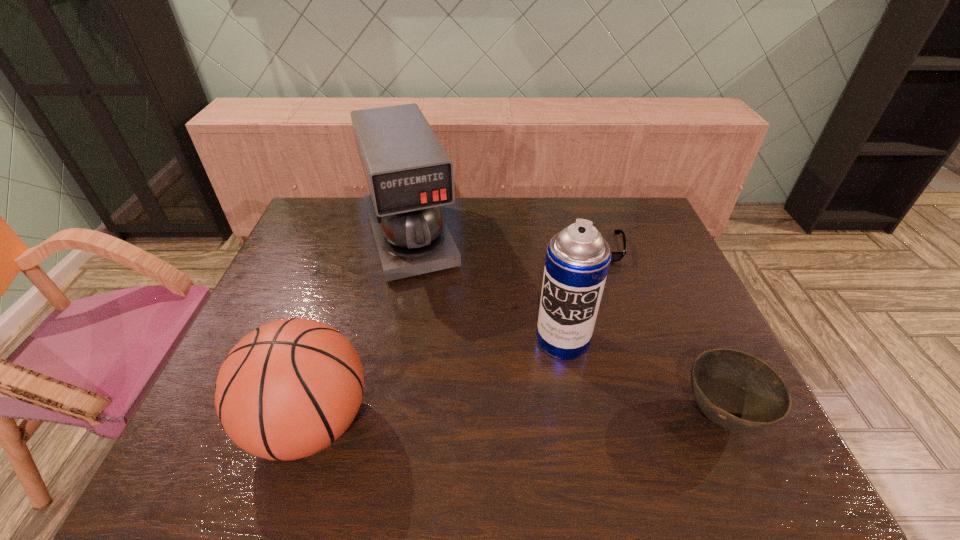
The height and width of the screenshot is (540, 960). Find the location of `basketball`. basketball is located at coordinates (290, 388).

Identify the location of bowl. (738, 391).

Where is `the shortest object`? the shortest object is located at coordinates pyautogui.click(x=615, y=256).

Image resolution: width=960 pixels, height=540 pixels. I want to click on coffee maker, so click(x=409, y=174).

You are a GUI agent. You are given a task and a screenshot of the screen. Output one action in this format:
    pyautogui.click(x=<x>, y=<y>)
    Task: Click on the third nearest object
    This screenshot has width=960, height=540.
    Given the screenshot: What is the action you would take?
    pyautogui.click(x=577, y=260)

The image size is (960, 540). I want to click on the third object from right to left, so pyautogui.click(x=577, y=260).

You are a GUI agent. You are given a task and a screenshot of the screen. Output one action in this format:
    pyautogui.click(x=<x>, y=<y>)
    Task: Click on the free region located on the surface of the basketball near the brand logo
    The width and height of the screenshot is (960, 540).
    Given the screenshot: What is the action you would take?
    pyautogui.click(x=226, y=423)

Locate an element on the screen. The height and width of the screenshot is (540, 960). vacant position located 0.100m on the surface of the basketball near the brand logo is located at coordinates (203, 423).

What are the coordinates of `blank space located 0.050m on the surface of the basketball near the brand logo` in the screenshot? It's located at (226, 423).

In order to click on free space located 0.190m on the left of the bowl in this screenshot , I will do `click(591, 416)`.